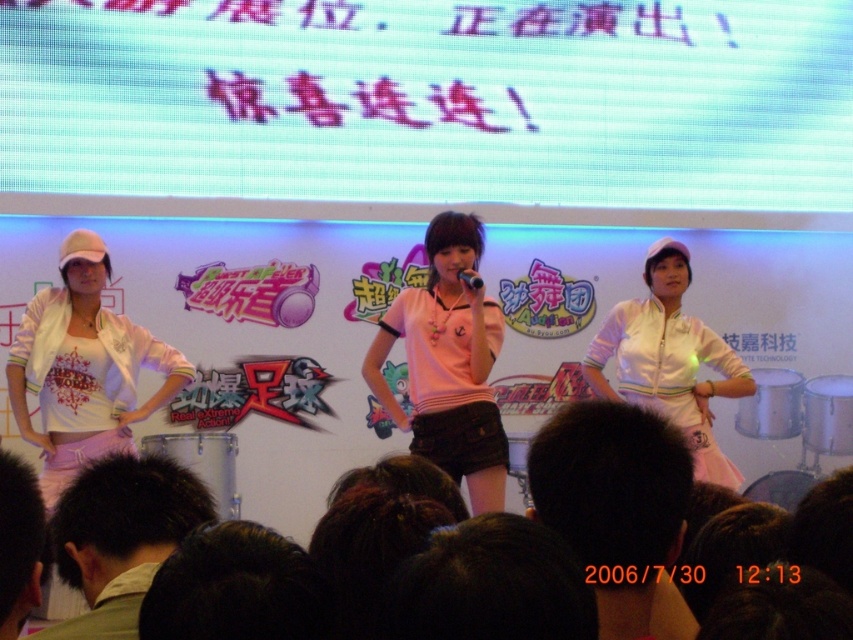
Who is more forward, (86, 289) or (688, 369)?

Point (86, 289) is in front.

Can you confirm if white matte jacket at left is positioned below white matte jacket at center?

No.

This screenshot has width=853, height=640. Find the location of `white matte jacket at left`. white matte jacket at left is located at coordinates (83, 368).

Is white matte jacket at center to the left of black matte microphone at center from the viewer's perspective?

In fact, white matte jacket at center is to the right of black matte microphone at center.

Which of these two, white matte jacket at center or black matte microphone at center, stands shorter?

With less height is black matte microphone at center.

Is point (683, 403) in front of point (469, 288)?

No, it is behind (469, 288).

This screenshot has height=640, width=853. I want to click on white matte jacket at center, so click(x=669, y=358).

Between white matte projection screen at upper center and dark green hair at lower left, which one is positioned higher?

white matte projection screen at upper center is higher up.

Does white matte projection screen at upper center have a lesser height compared to dark green hair at lower left?

In fact, white matte projection screen at upper center may be taller than dark green hair at lower left.

You are a GUI agent. You are given a task and a screenshot of the screen. Output one action in this format:
    pyautogui.click(x=<x>, y=<y>)
    Task: Click on the white matte projection screen at upper center
    
    Given the screenshot: What is the action you would take?
    pyautogui.click(x=432, y=100)

Where is `white matte projection screen at upper center`? white matte projection screen at upper center is located at coordinates (432, 100).